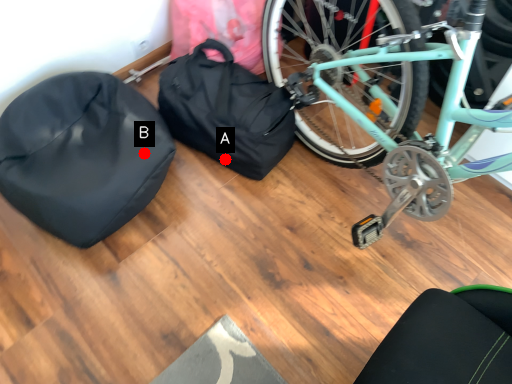
Question: Two points are circled on the image, labeled by A and B beside each circle. Which point is closer to the camera?

Choices:
 (A) A is closer
 (B) B is closer

Answer: (B)